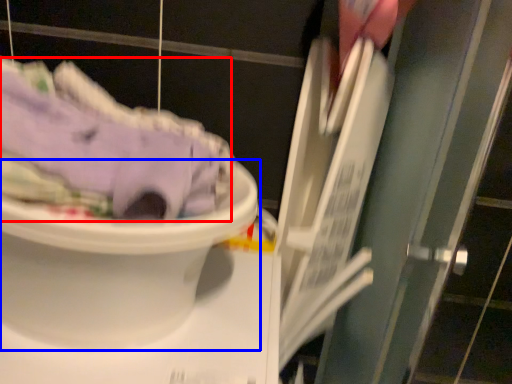
Question: Which point is further to the camera, clothing (highlighted by a red box) or toilet (highlighted by a blue box)?

Choices:
 (A) clothing
 (B) toilet

Answer: (B)